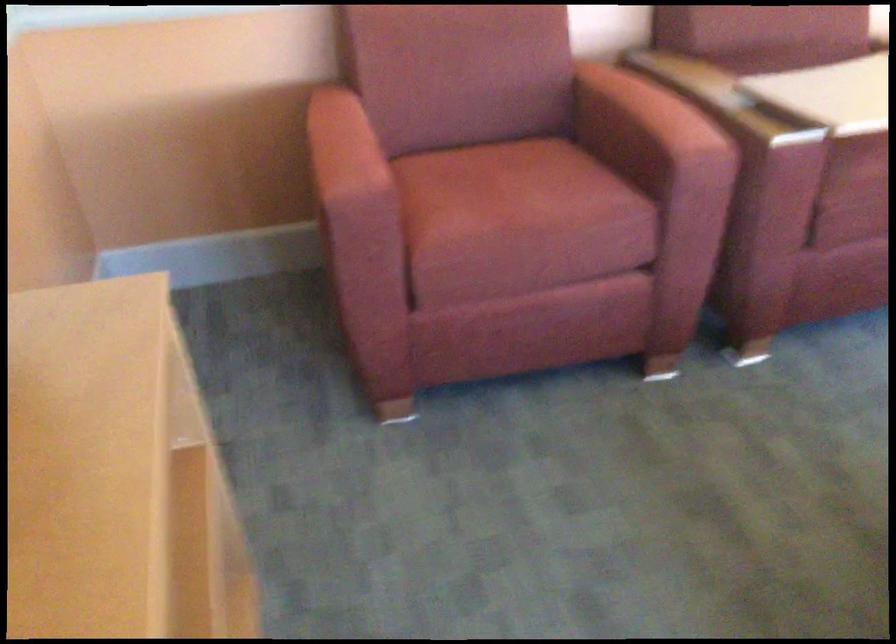
You are a GUI agent. You are given a task and a screenshot of the screen. Output one action in this format:
    pyautogui.click(x=<x>, y=<y>)
    Task: Click on the red chair sitting surface
    
    Given the screenshot: What is the action you would take?
    pyautogui.click(x=518, y=181)